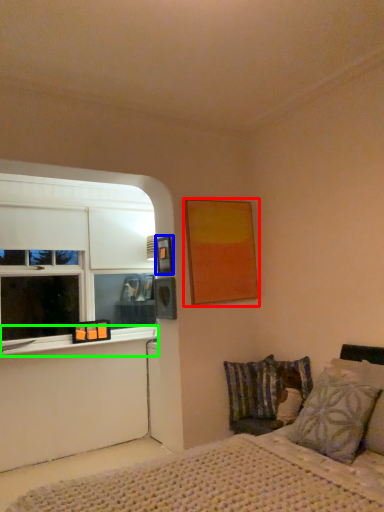
Question: Based on their relative distances, which object is nearer to picture frame (highlighted by a red box)? Choose from picture frame (highlighted by a blue box) and window sill (highlighted by a green box).

Choices:
 (A) picture frame
 (B) window sill

Answer: (A)